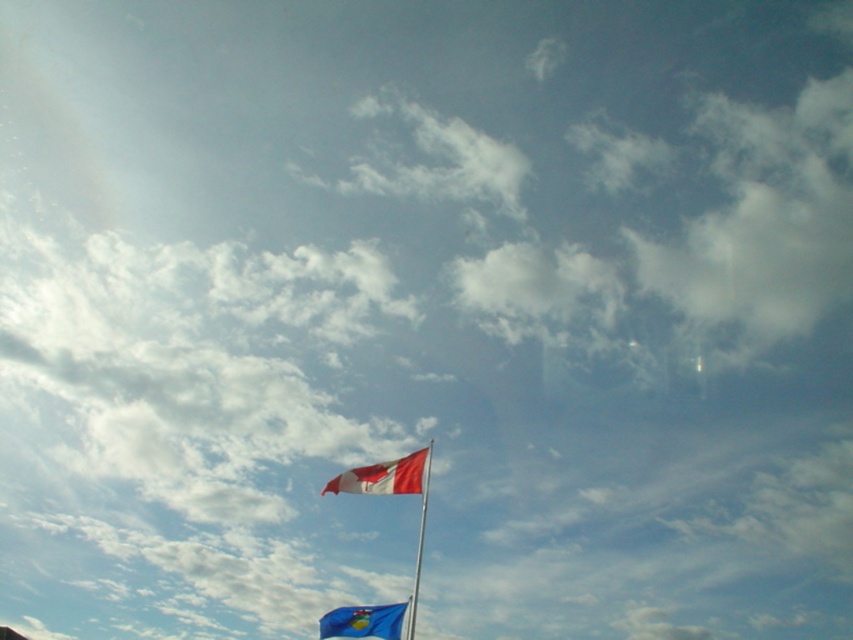
How much distance is there between red fabric flag at center and metallic flag pole at center?

red fabric flag at center and metallic flag pole at center are 2.67 meters apart.

Who is positioned more to the left, red fabric flag at center or metallic flag pole at center?

red fabric flag at center is more to the left.

Between point (398, 467) and point (426, 484), which one is positioned behind?

The point (398, 467) is behind.

This screenshot has height=640, width=853. I want to click on red fabric flag at center, so click(384, 476).

Can you confirm if red fabric flag at center is shorter than blue fabric flag at lower center?

Indeed, red fabric flag at center has a lesser height compared to blue fabric flag at lower center.

Does red fabric flag at center have a lesser width compared to blue fabric flag at lower center?

No.

The image size is (853, 640). What do you see at coordinates (384, 476) in the screenshot?
I see `red fabric flag at center` at bounding box center [384, 476].

This screenshot has height=640, width=853. I want to click on red fabric flag at center, so click(x=384, y=476).

Between point (337, 636) and point (422, 484), which one is positioned in front?

Point (337, 636)

Is blue fabric flag at lower center positioned before metallic flag pole at center?

No.

Is point (364, 609) behind point (419, 572)?

No, it is in front of (419, 572).

Locate an element on the screen. Image resolution: width=853 pixels, height=640 pixels. blue fabric flag at lower center is located at coordinates (363, 621).